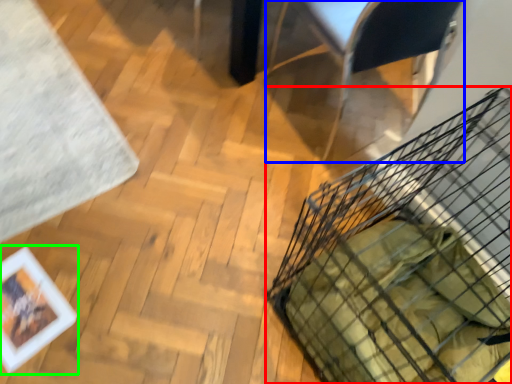
Question: Considering the real-world distances, which object is farthest from basket (highlighted by a red box)? armchair (highlighted by a blue box) or picture frame (highlighted by a green box)?

Choices:
 (A) armchair
 (B) picture frame

Answer: (B)